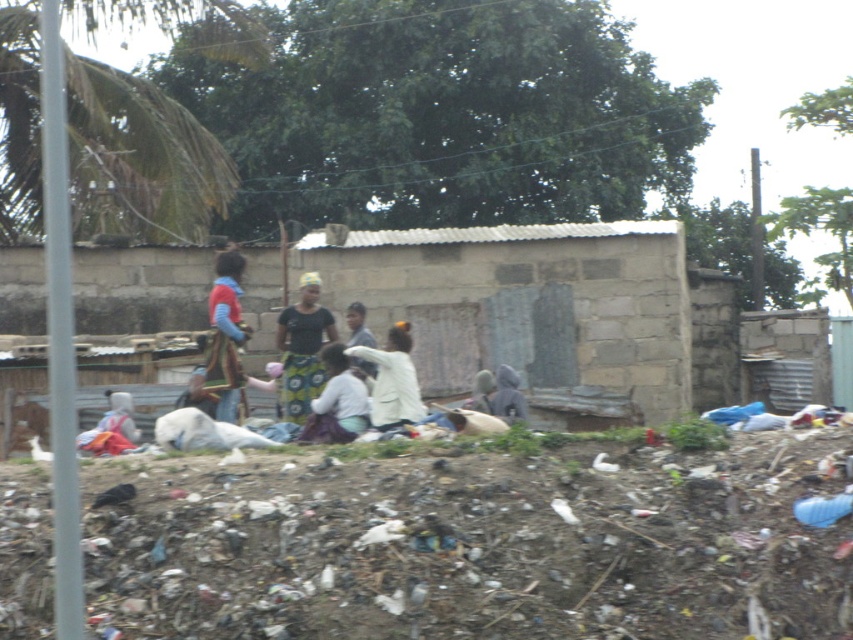
Does multicolored fabric at center appear over white matte jacket at center?

Correct, multicolored fabric at center is located above white matte jacket at center.

Which is in front, point (230, 339) or point (376, 378)?

Positioned in front is point (376, 378).

Which is behind, point (234, 342) or point (404, 381)?

Positioned behind is point (234, 342).

Find the location of a particular element. multicolored fabric at center is located at coordinates (225, 337).

Can you confirm if multicolored fabric at center is wider than gray matte jacket at center?

In fact, multicolored fabric at center might be narrower than gray matte jacket at center.

Is point (213, 381) positioned behind point (498, 410)?

No, (213, 381) is closer to viewer.

What do you see at coordinates (225, 337) in the screenshot? I see `multicolored fabric at center` at bounding box center [225, 337].

You are a GUI agent. You are given a task and a screenshot of the screen. Output one action in this format:
    pyautogui.click(x=<x>, y=<y>)
    Task: Click on the multicolored fabric at center
    
    Given the screenshot: What is the action you would take?
    pyautogui.click(x=225, y=337)

Which is in front, point (224, 388) or point (335, 346)?

Point (335, 346) is more forward.

This screenshot has width=853, height=640. I want to click on multicolored fabric at center, so click(225, 337).